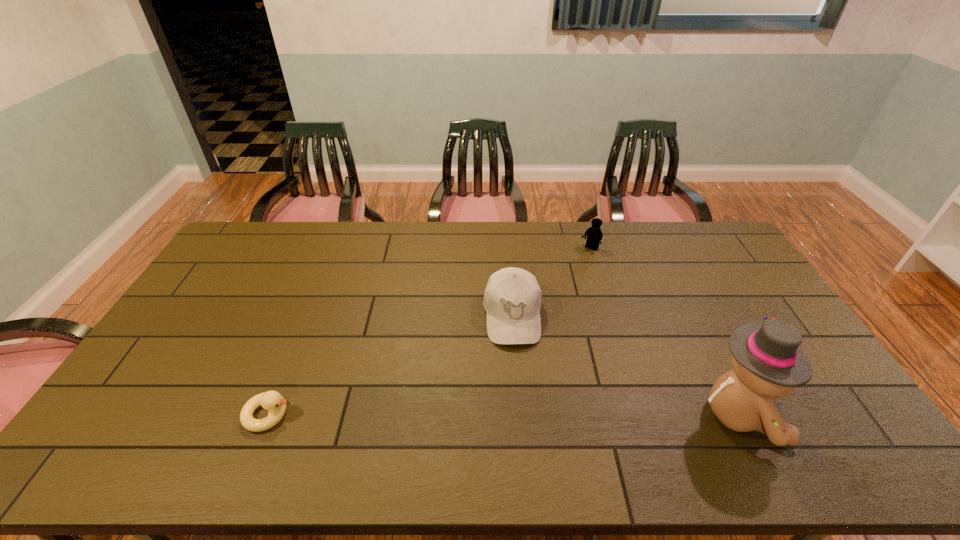
You are a GUI agent. You are given a task and a screenshot of the screen. Output one action in this format:
    pyautogui.click(x=<x>, y=<y>)
    Task: Click on the free space on the desktop that is between the shortest object and the tallest object and is positioned on the front-facing side of the third object from right to left
    The width and height of the screenshot is (960, 540).
    Given the screenshot: What is the action you would take?
    pyautogui.click(x=520, y=415)

Where is `vacant space on the desktop that is between the leftmost object and the tallest object and is positioned on the front-facing side of the farthest object`? vacant space on the desktop that is between the leftmost object and the tallest object and is positioned on the front-facing side of the farthest object is located at coordinates (457, 415).